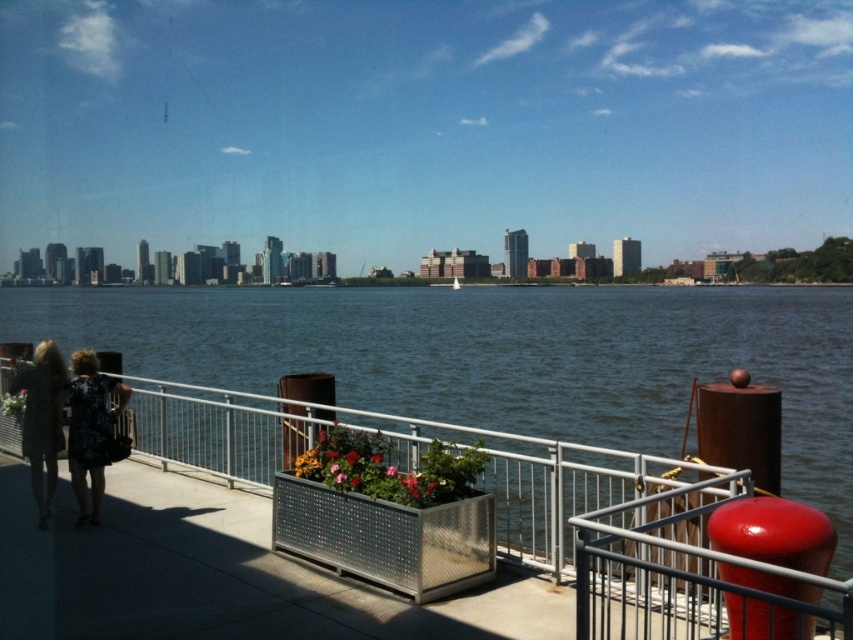
You are a photographer standing on the walkway and want to take a picture of both the black floral dress at lower left and the printed fabric dress at lower left. To ensure both dresses are in frame, should you adjust your camera to include more to the left or to the right side of the current view?

The black floral dress at lower left is to the right of the printed fabric dress at lower left. To include both in the frame, you should adjust your camera to include more to the left side so that the printed fabric dress at lower left is fully captured.

You are standing at the point with coordinates point (79, 440) and want to look at the city skyline in the distance. Is the point (624, 387) blocking your view? Please explain your reasoning.

Point (624, 387) is behind point (79, 440), so it is not blocking your view since it is located further away from your current position.